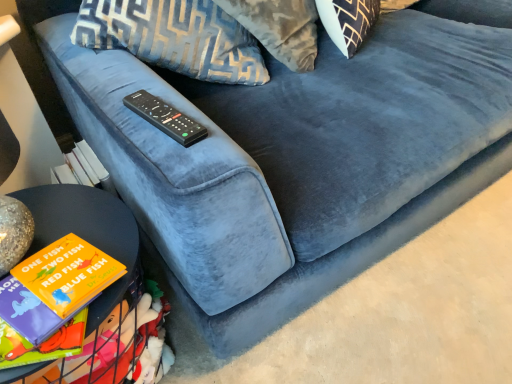
Locate an element on the screen. Image resolution: width=512 pixels, height=384 pixels. vacant point above matte black table at lower left (from a real-world perspective) is located at coordinates (x=46, y=286).